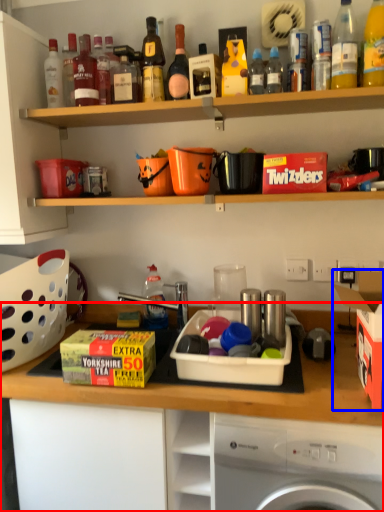
Question: Which of the following is the farthest to the observer, cabinetry (highlighted by a red box) or cardboard box (highlighted by a blue box)?

Choices:
 (A) cabinetry
 (B) cardboard box

Answer: (A)